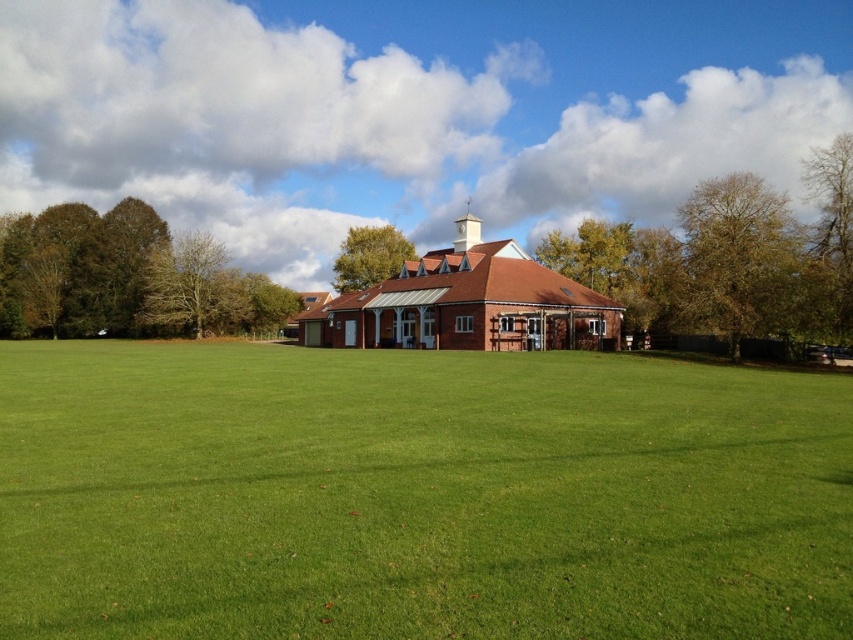
Between brown textured tree at center and brown textured tree at upper right, which one is positioned lower?

brown textured tree at center is below.

Is brown textured tree at center taller than brown textured tree at upper right?

No, brown textured tree at center is not taller than brown textured tree at upper right.

Is point (624, 237) less distant than point (840, 289)?

That is False.

Image resolution: width=853 pixels, height=640 pixels. I want to click on brown textured tree at center, so click(x=621, y=268).

This screenshot has height=640, width=853. Describe the element at coordinates (737, 257) in the screenshot. I see `brown leafy tree at right` at that location.

Can you confirm if brown leafy tree at right is positioned below brown textured tree at center?

Incorrect, brown leafy tree at right is not positioned below brown textured tree at center.

Is point (732, 310) behind point (587, 260)?

No, it is not.

You are a GUI agent. You are given a task and a screenshot of the screen. Output one action in this format:
    pyautogui.click(x=<x>, y=<y>)
    Task: Click on the brown leafy tree at right
    Image resolution: width=853 pixels, height=640 pixels.
    Given the screenshot: What is the action you would take?
    pyautogui.click(x=737, y=257)

Between point (635, 332) and point (79, 337), which one is positioned behind?

The point (79, 337) is more distant.

Can you confirm if brown leafy tree at upper right is thinner than green leafy tree at left?

No.

What do you see at coordinates (729, 259) in the screenshot?
I see `brown leafy tree at upper right` at bounding box center [729, 259].

This screenshot has height=640, width=853. Find the location of `brown leafy tree at upper right`. brown leafy tree at upper right is located at coordinates (729, 259).